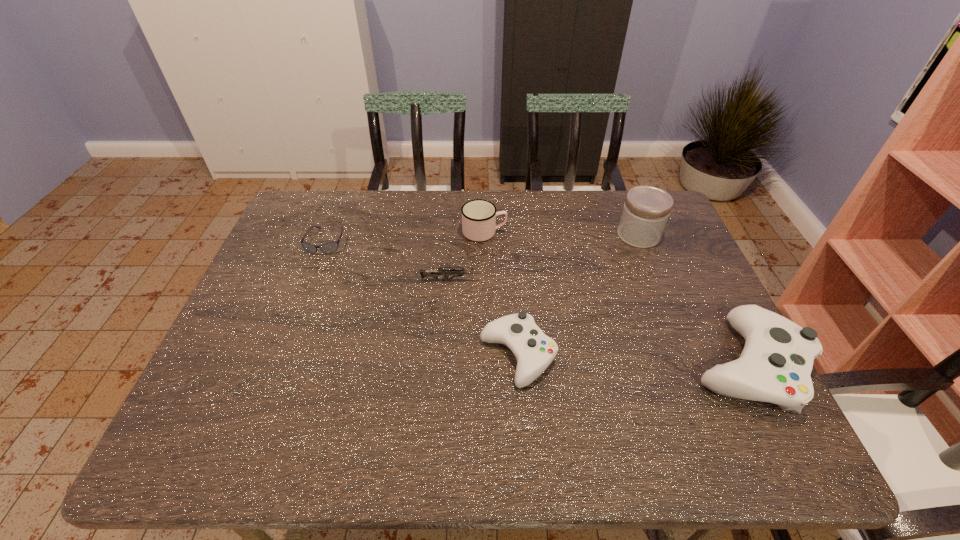
Image resolution: width=960 pixels, height=540 pixels. I want to click on free point that keeps the controls evenly spaced on the left, so click(x=294, y=348).